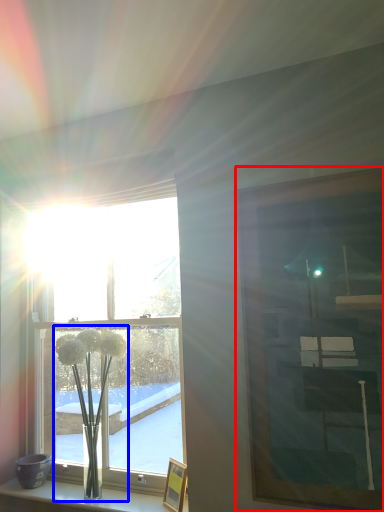
Question: Which object appears closest to the camera in this image, picture frame (highlighted by a red box) or floral arrangement (highlighted by a blue box)?

Choices:
 (A) picture frame
 (B) floral arrangement

Answer: (A)